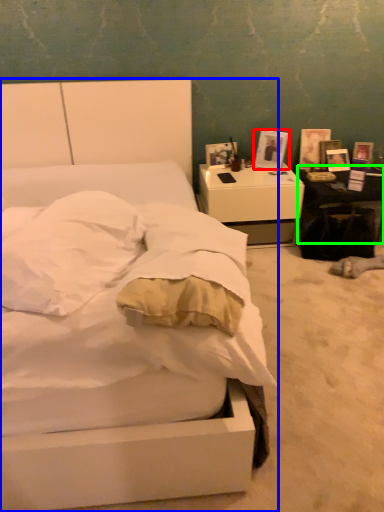
Question: Based on their relative distances, which object is farther from picture frame (highlighted by a red box)? Choose from bed (highlighted by a blue box) and table (highlighted by a green box).

Choices:
 (A) bed
 (B) table

Answer: (A)